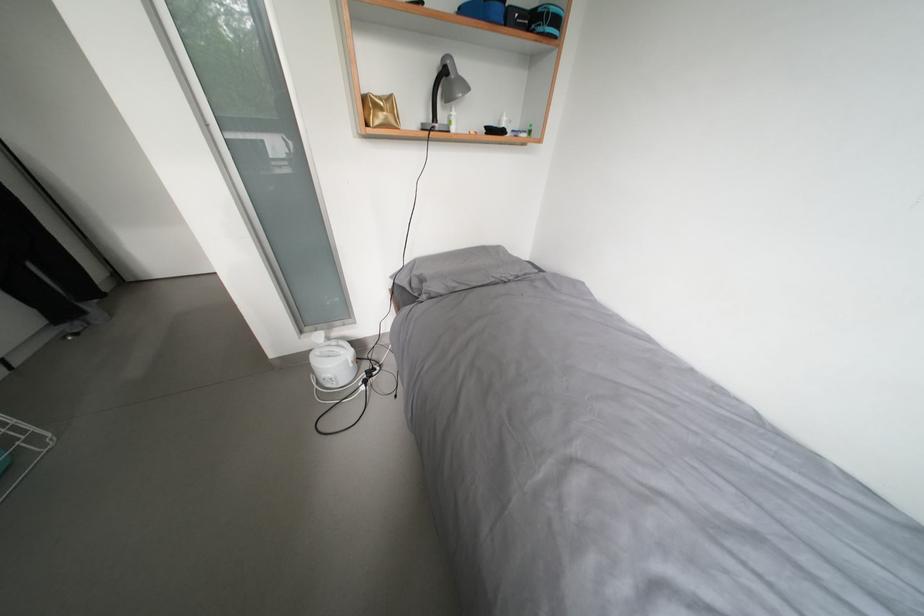
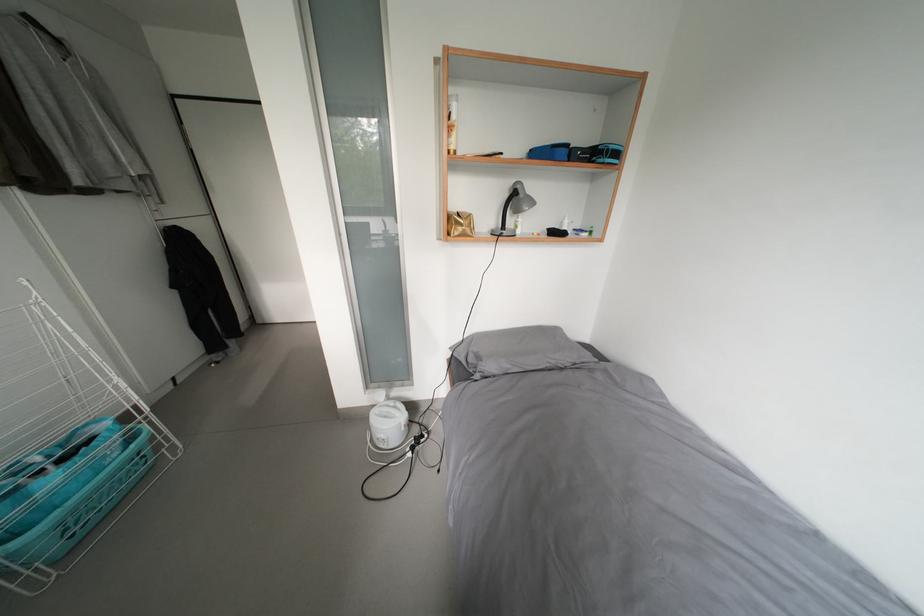
Find the pixel in the second image that matches point 452,87 in the first image.

(521, 205)